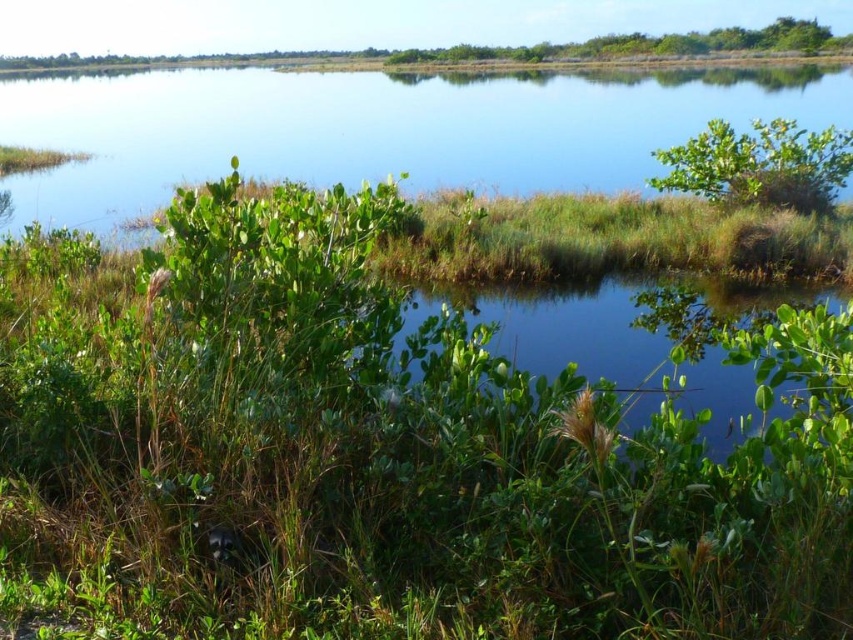
You are a photographer standing in the wetland and want to capture both the green grassy water at upper center and the green leafy bush at upper right in a single shot. Which object will appear closer to you in the photo?

The green grassy water at upper center will appear closer to you in the photo because it is further to the viewer than the green leafy bush at upper right.

You are standing at the edge of the wetland and notice a point marked at coordinates [376,131]. According to the scene description, what does this point indicate?

The point at [376,131] marks green grassy water at upper center.